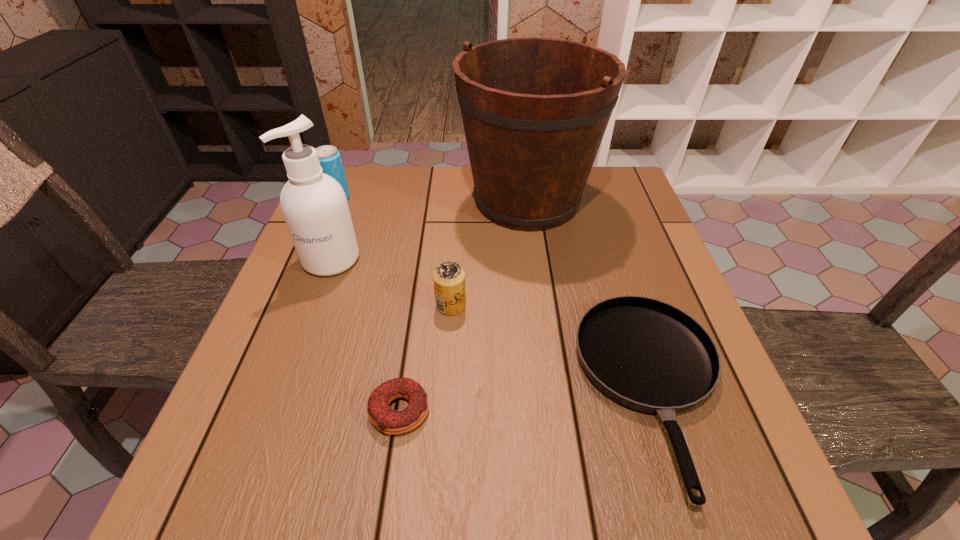
What are the coordinates of `free space located on the back of the doughnut` in the screenshot? It's located at (423, 246).

This screenshot has width=960, height=540. What are the coordinates of `bucket at the far edge` in the screenshot? It's located at (535, 110).

The width and height of the screenshot is (960, 540). Identify the location of soda can at the far edge. (x=329, y=157).

Identify the location of object at the near edge. The image size is (960, 540). (648, 355).

The height and width of the screenshot is (540, 960). I want to click on cleansing agent at the left edge, so click(x=314, y=206).

Image resolution: width=960 pixels, height=540 pixels. What are the coordinates of `soda can that is positioned at the left edge` in the screenshot? It's located at (329, 157).

Where is `bucket present at the right edge`? The image size is (960, 540). bucket present at the right edge is located at coordinates (535, 110).

I want to click on frying pan positioned at the right edge, so click(x=648, y=355).

Image resolution: width=960 pixels, height=540 pixels. Find the location of `object at the far left corner`. object at the far left corner is located at coordinates [329, 157].

In order to click on object situated at the far right corner in this screenshot , I will do `click(535, 110)`.